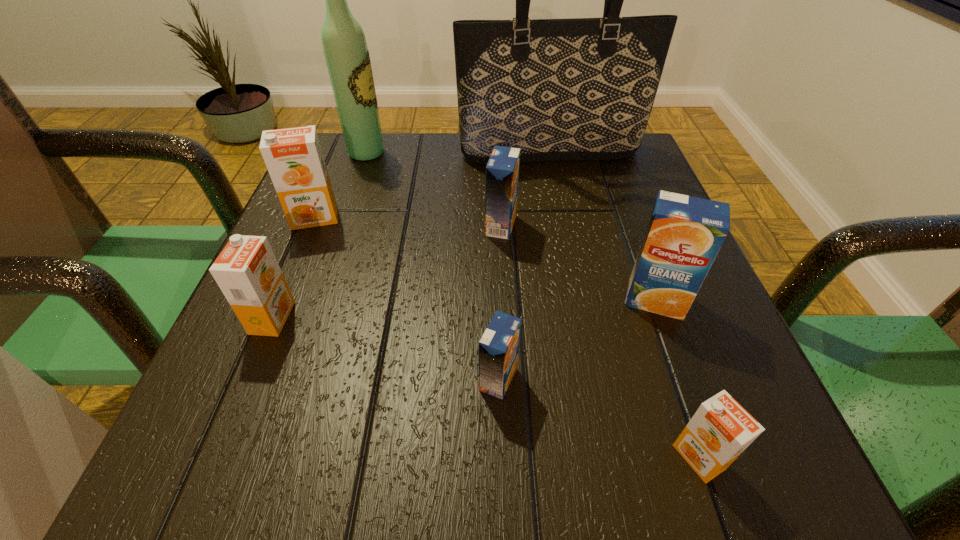
Image resolution: width=960 pixels, height=540 pixels. I want to click on the tallest object, so click(x=582, y=88).

Identify the location of black tote bag. (582, 88).

This screenshot has height=540, width=960. I want to click on wine bottle, so click(346, 52).

What are the coordinates of `the seventh shortest object` in the screenshot? It's located at (346, 52).

The image size is (960, 540). I want to click on the biggest orange orange juice, so click(293, 156).

What are the coordinates of `the second nearest blue orange_juice` in the screenshot? It's located at (684, 235).

Where is `the rightmost blue orange_juice`? the rightmost blue orange_juice is located at coordinates (684, 235).

Identify the location of the farthest blue orange_juice. The image size is (960, 540). (502, 171).

Where is `the second farthest orange orange juice`? This screenshot has height=540, width=960. the second farthest orange orange juice is located at coordinates (247, 272).

I want to click on the second nearest object, so click(498, 348).